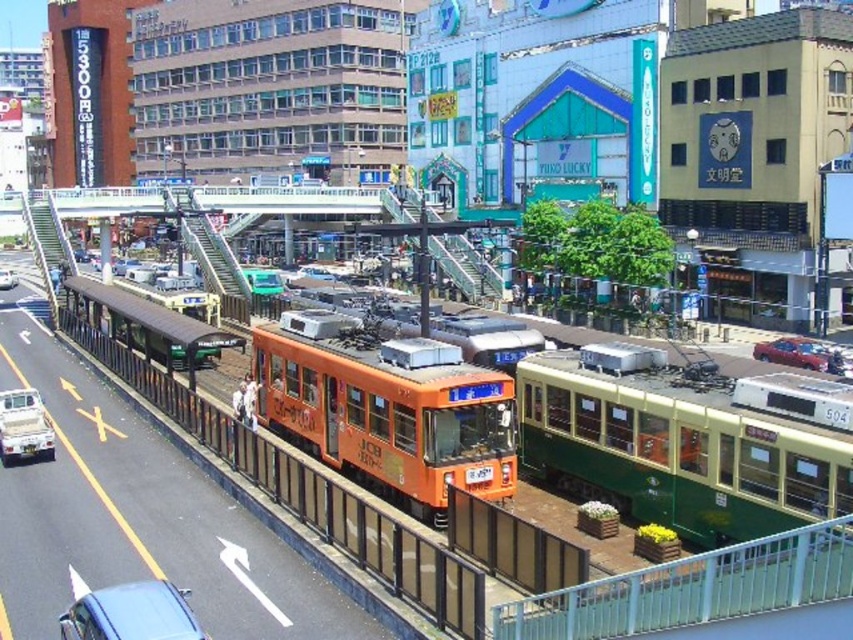
Question: Which point appears closest to the camera in this image?

Choices:
 (A) (13, 278)
 (B) (798, 337)
 (C) (508, 401)

Answer: (C)

Question: In this image, where is green polished wood passenger train at center located relative to orange matte train at center?

Choices:
 (A) below
 (B) above

Answer: (A)

Question: Estimate the real-world distances between objects in this image. Which object is closer to the shiny red sedan at right?

Choices:
 (A) metallic blue car at lower left
 (B) green polished wood passenger train at center
 (C) metallic silver car at lower left

Answer: (B)

Question: Can you confirm if green polished wood passenger train at center is positioned below shiny red sedan at right?

Choices:
 (A) yes
 (B) no

Answer: (A)

Question: Which object is farther from the camera taking this photo?

Choices:
 (A) shiny red sedan at right
 (B) orange matte train at center

Answer: (A)

Question: Does green polished wood passenger train at center lie in front of metallic blue car at lower left?

Choices:
 (A) yes
 (B) no

Answer: (B)